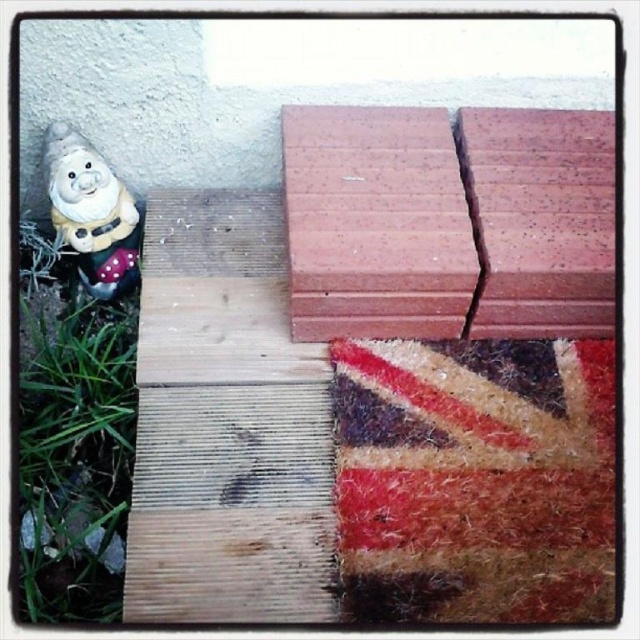
Question: Observing the image, what is the correct spatial positioning of red brick at center in reference to white ceramic gnome at upper left?

Choices:
 (A) below
 (B) above

Answer: (B)

Question: Among these objects, which one is farthest from the camera?

Choices:
 (A) green grass at lower left
 (B) red brick at center
 (C) white ceramic gnome at upper left

Answer: (C)

Question: Can you confirm if red brick at center is smaller than white ceramic gnome at upper left?

Choices:
 (A) yes
 (B) no

Answer: (B)

Question: Estimate the real-world distances between objects in this image. Which object is farther from the white ceramic gnome at upper left?

Choices:
 (A) green grass at lower left
 (B) red brick at center

Answer: (B)

Question: Among these objects, which one is farthest from the camera?

Choices:
 (A) green grass at lower left
 (B) red brick at center
 (C) white ceramic gnome at upper left

Answer: (C)

Question: Is green grass at lower left behind white ceramic gnome at upper left?

Choices:
 (A) yes
 (B) no

Answer: (B)